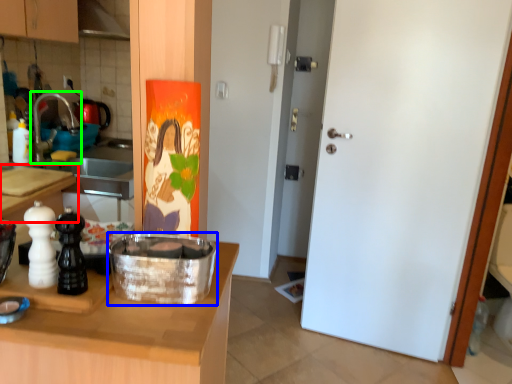
Question: Which object is positioned closest to countertop (highlighted by a red box)? Select from kitchen appliance (highlighted by a blue box) and faucet (highlighted by a green box).

Choices:
 (A) kitchen appliance
 (B) faucet

Answer: (B)